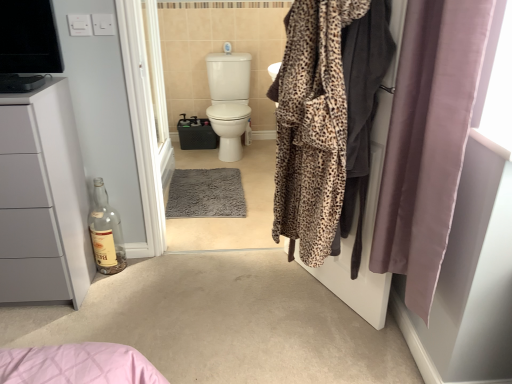
You are a GUI agent. You are given a task and a screenshot of the screen. Output one action in this format:
    pyautogui.click(x=<x>, y=<y>)
    Task: Click on the free space that is in between matte white cabinet at left and clear glass bottle at lower left
    
    Given the screenshot: What is the action you would take?
    pyautogui.click(x=97, y=290)